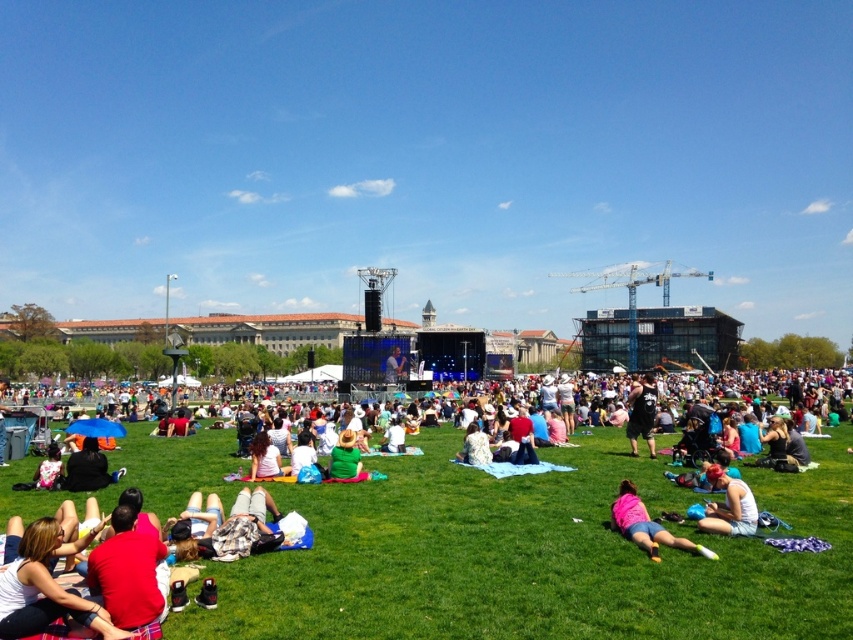
Based on the photo, can you confirm if black cotton shirt at center is bigger than light pink fabric at center?

Yes, black cotton shirt at center is bigger than light pink fabric at center.

Does black cotton shirt at center appear on the right side of light pink fabric at center?

Yes, black cotton shirt at center is to the right of light pink fabric at center.

Who is more forward, (654,392) or (264,458)?

Point (264,458)

Identify the location of black cotton shirt at center. (641, 413).

Who is positioned more to the left, red plaid shirt at lower left or white cotton tank top at lower right?

Positioned to the left is red plaid shirt at lower left.

Can you confirm if red plaid shirt at lower left is positioned to the right of white cotton tank top at lower right?

No, red plaid shirt at lower left is not to the right of white cotton tank top at lower right.

Locate an element on the screen. red plaid shirt at lower left is located at coordinates (126, 572).

Consider the image. Who is more distant from viewer, [86,609] or [633,403]?

The point [633,403] is more distant.

From the picture: Is matte red shirt at lower left to the left of black cotton shirt at center from the viewer's perspective?

Yes, matte red shirt at lower left is to the left of black cotton shirt at center.

Find the location of a particular element. The height and width of the screenshot is (640, 853). matte red shirt at lower left is located at coordinates (45, 588).